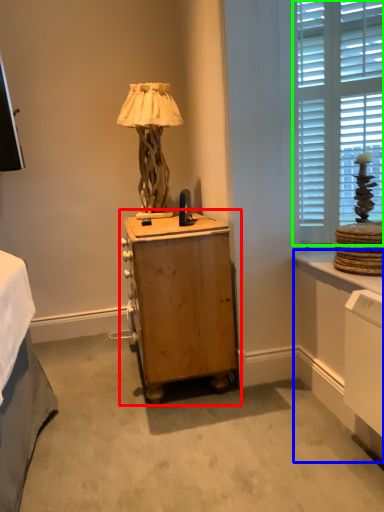
Question: Which object is the closest to the nightstand (highlighted by a red box)? Choose among these: vanity (highlighted by a blue box) or window (highlighted by a green box).

Choices:
 (A) vanity
 (B) window

Answer: (A)